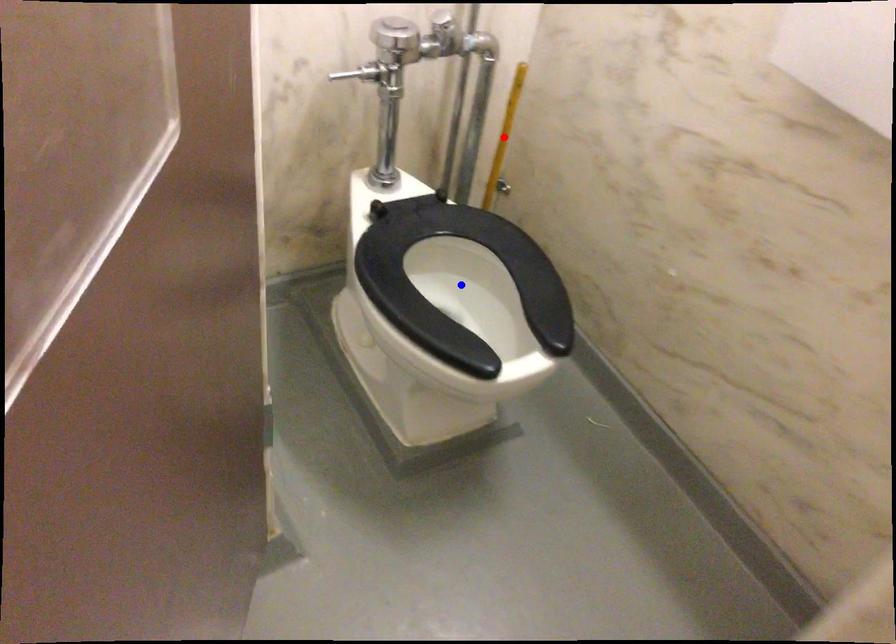
Question: Which of the two points in the image is closer to the camera?

Choices:
 (A) Blue point is closer.
 (B) Red point is closer.

Answer: (A)